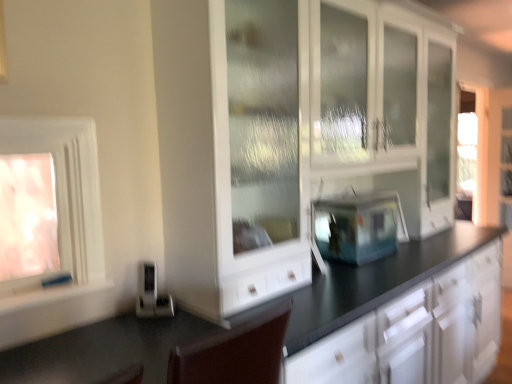
The width and height of the screenshot is (512, 384). What are the coordinates of `vacant region below white glossy window at left, placed as the 2th window when sorted from left to right (from a real-world perspective)` in the screenshot? It's located at (60, 290).